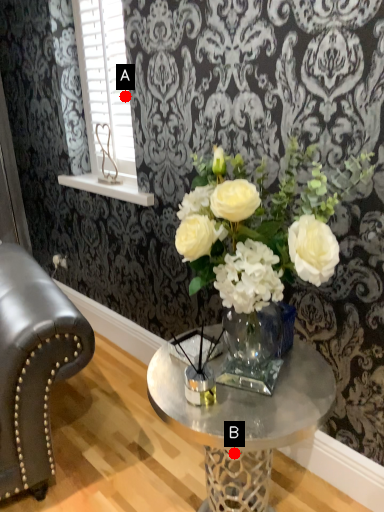
Question: Two points are circled on the image, labeled by A and B beside each circle. Which point is farther to the camera?

Choices:
 (A) A is further
 (B) B is further

Answer: (A)